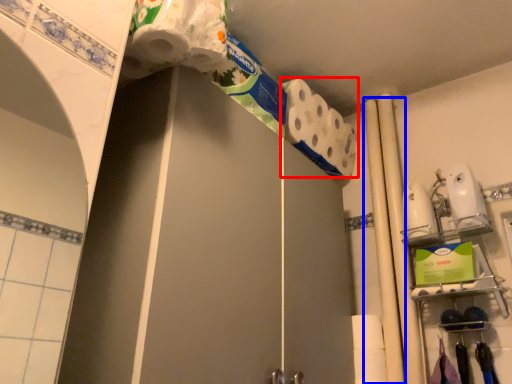
Question: Which object appears closest to the camera in this image, toilet paper (highlighted by a red box) or beam (highlighted by a blue box)?

Choices:
 (A) toilet paper
 (B) beam

Answer: (B)